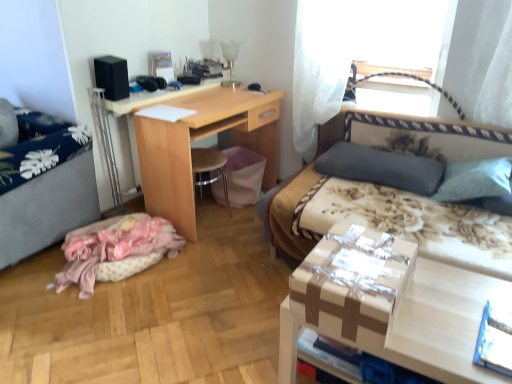
Image resolution: width=512 pixels, height=384 pixels. What do you see at coordinates (353, 283) in the screenshot?
I see `matte brown cardboard box at center` at bounding box center [353, 283].

The width and height of the screenshot is (512, 384). Find the location of `gray fabric hospital bed at left`. gray fabric hospital bed at left is located at coordinates (44, 184).

You are a GUI agent. You are given a task and a screenshot of the screen. Output one action in this format:
    pyautogui.click(x=<x>, y=<y>)
    Task: Click on the matte cardboard box at lower right
    The height and width of the screenshot is (384, 512).
    Given the screenshot: What is the action you would take?
    pyautogui.click(x=393, y=315)

Does floral fabric bed at right have a greater width compared to wooden desk at center?

Yes, floral fabric bed at right is wider than wooden desk at center.

Which is correct: floral fabric bed at right is inside wooden desk at center, or outside of it?

floral fabric bed at right is located beyond the bounds of wooden desk at center.

Does floral fabric bed at right lie behind wooden desk at center?

No, the depth of floral fabric bed at right is less than that of wooden desk at center.

In the scene shown: Can we say dark gray fabric pillow at upper right lies outside gray fabric hospital bed at left?

Yes, dark gray fabric pillow at upper right is not within gray fabric hospital bed at left.

From the image's perspective, is dark gray fabric pillow at upper right located beneath gray fabric hospital bed at left?

Indeed, from the image's perspective, dark gray fabric pillow at upper right is shown beneath gray fabric hospital bed at left.

Identify the location of hospital bed on the left side of dark gray fabric pillow at upper right. (44, 184).

Could you tell me if dark gray fabric pillow at upper right is facing gray fabric hospital bed at left?

No, dark gray fabric pillow at upper right is not oriented towards gray fabric hospital bed at left.

Based on the photo, would you say dark gray fabric pillow at upper right is outside wooden desk at center?

Yes.

Is the position of dark gray fabric pillow at upper right less distant than that of wooden desk at center?

That is True.

Between dark gray fabric pillow at upper right and wooden desk at center, which one appears on the left side from the viewer's perspective?

From the viewer's perspective, wooden desk at center appears more on the left side.

Can you tell me how much gray fabric hospital bed at left and floral fabric bed at right differ in facing direction?

There is a 2.85-degree angle between the facing directions of gray fabric hospital bed at left and floral fabric bed at right.

Can you see gray fabric hospital bed at left touching floral fabric bed at right?

No, gray fabric hospital bed at left is not next to floral fabric bed at right.

Based on the photo, which is more to the left, gray fabric hospital bed at left or floral fabric bed at right?

gray fabric hospital bed at left is more to the left.

Which of these two, gray fabric hospital bed at left or floral fabric bed at right, is thinner?

gray fabric hospital bed at left.

Which object is further away from the camera taking this photo, matte cardboard box at lower right or floral fabric bed at right?

floral fabric bed at right is more distant.

Between matte cardboard box at lower right and floral fabric bed at right, which one appears on the left side from the viewer's perspective?

From the viewer's perspective, matte cardboard box at lower right appears more on the left side.

Which of these two, matte cardboard box at lower right or floral fabric bed at right, is thinner?

With smaller width is matte cardboard box at lower right.

Is matte brown cardboard box at center placed right next to black matte speaker at upper left?

No, matte brown cardboard box at center is not making contact with black matte speaker at upper left.

Is matte brown cardboard box at center bigger than black matte speaker at upper left?

Yes.

From the image's perspective, which one is positioned lower, matte brown cardboard box at center or black matte speaker at upper left?

matte brown cardboard box at center, from the image's perspective.

Considering the sizes of objects matte brown cardboard box at center and black matte speaker at upper left in the image provided, who is wider, matte brown cardboard box at center or black matte speaker at upper left?

matte brown cardboard box at center.

Where is `studio couch above the pink fabric at lower left (from a real-world perspective)`? studio couch above the pink fabric at lower left (from a real-world perspective) is located at coordinates (391, 221).

From the image's perspective, is pink fabric at lower left on floral fabric bed at right?

Actually, pink fabric at lower left appears below floral fabric bed at right in the image.

From a real-world perspective, does pink fabric at lower left stand above floral fabric bed at right?

Actually, pink fabric at lower left is physically below floral fabric bed at right in the real world.

Is pink fabric at lower left inside or outside of floral fabric bed at right?

pink fabric at lower left is located beyond the bounds of floral fabric bed at right.

You are a GUI agent. You are given a task and a screenshot of the screen. Output one action in this format:
    pyautogui.click(x=<x>, y=<y>)
    Task: Click on the table on the left of floral fabric bed at right
    
    Given the screenshot: What is the action you would take?
    pyautogui.click(x=202, y=138)

Find the location of `pillow below the gray fabric hospital bed at left (from the image's perspective)`. pillow below the gray fabric hospital bed at left (from the image's perspective) is located at coordinates (381, 168).

From the image, which object appears to be farther from matte cardboard box at lower right, wooden desk at center or floral fabric bed at right?

wooden desk at center is positioned further to the anchor matte cardboard box at lower right.

Based on the photo, based on their spatial positions, is matte brown cardboard box at center or matte cardboard box at lower right further from black matte speaker at upper left?

matte cardboard box at lower right is positioned further to the anchor black matte speaker at upper left.

Looking at the image, which one is located further to wooden desk at center, pink fabric at lower left or dark gray fabric pillow at upper right?

dark gray fabric pillow at upper right is positioned further to the anchor wooden desk at center.

Looking at the image, which one is located closer to black matte speaker at upper left, matte brown cardboard box at center or floral fabric bed at right?

Among the two, floral fabric bed at right is located nearer to black matte speaker at upper left.

When comparing their distances from floral fabric bed at right, does pink fabric at lower left or gray fabric hospital bed at left seem further?

Based on the image, gray fabric hospital bed at left appears to be further to floral fabric bed at right.

Which object lies nearer to the anchor point dark gray fabric pillow at upper right, matte brown cardboard box at center or black matte speaker at upper left?

matte brown cardboard box at center.

Which object lies further to the anchor point gray fabric hospital bed at left, matte cardboard box at lower right or dark gray fabric pillow at upper right?

The object further to gray fabric hospital bed at left is matte cardboard box at lower right.

Considering their positions, is matte cardboard box at lower right positioned closer to matte brown cardboard box at center than dark gray fabric pillow at upper right?

The object closer to matte brown cardboard box at center is matte cardboard box at lower right.

Identify the location of desk located between pink fabric at lower left and floral fabric bed at right in the left-right direction. (393, 315).

Locate an element on the screen. The height and width of the screenshot is (384, 512). table between pink fabric at lower left and dark gray fabric pillow at upper right from left to right is located at coordinates (202, 138).

This screenshot has height=384, width=512. What are the coordinates of `studio couch positioned between matte cardboard box at lower right and dark gray fabric pillow at upper right from near to far` in the screenshot? It's located at (391, 221).

The image size is (512, 384). What are the coordinates of `cardboard box between gray fabric hospital bed at left and matte cardboard box at lower right from left to right` in the screenshot? It's located at (353, 283).